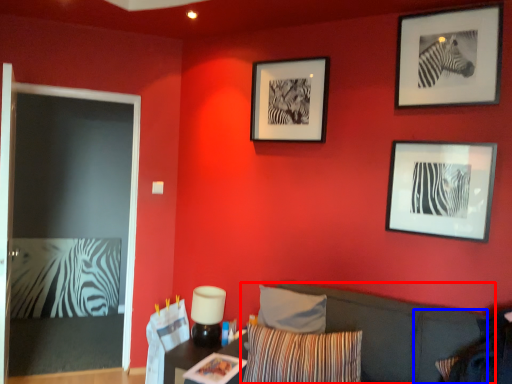
Question: Which object appears farthest to the camera in this image, couch (highlighted by a red box) or pillow (highlighted by a blue box)?

Choices:
 (A) couch
 (B) pillow

Answer: (B)